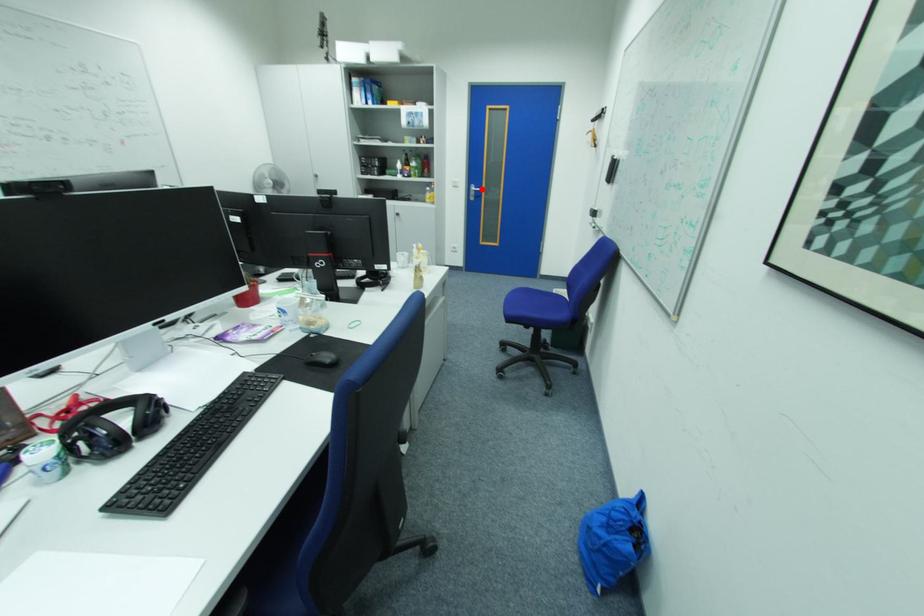
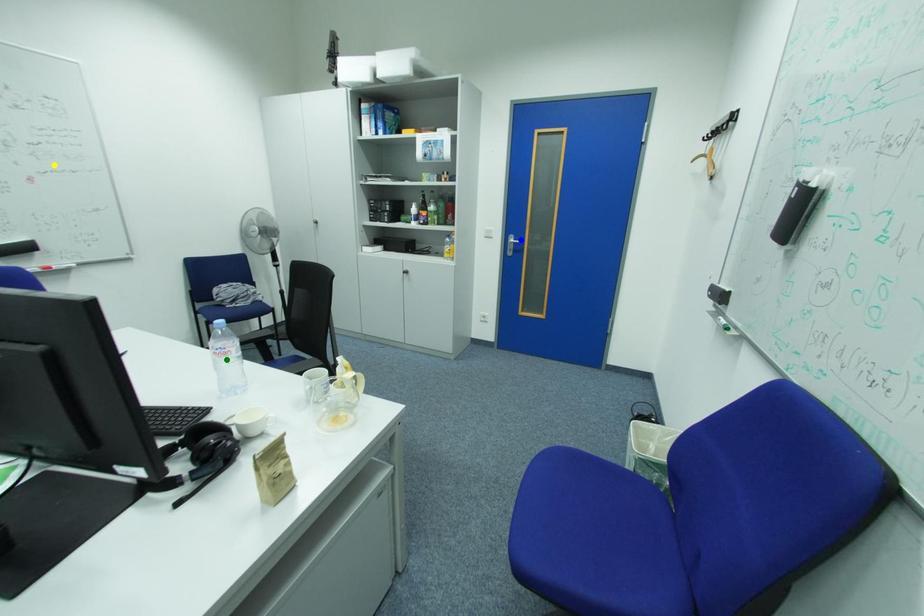
Question: I am providing you with two images of the same scene from different viewpoints. A red point is marked on the first image. You are given multiple points on the second image. In image 2, which mark is for the same physical point as the one in image 1?

Choices:
 (A) green point
 (B) yellow point
 (C) blue point

Answer: (C)